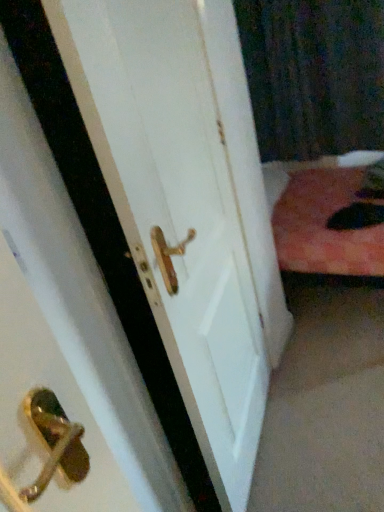
Question: Is white matte door handle at center thinner than black textured curtain at upper right?

Choices:
 (A) yes
 (B) no

Answer: (A)

Question: Is white matte door handle at center positioned far away from black textured curtain at upper right?

Choices:
 (A) yes
 (B) no

Answer: (A)

Question: Is white matte door handle at center next to black textured curtain at upper right and touching it?

Choices:
 (A) no
 (B) yes

Answer: (A)

Question: Is the depth of white matte door handle at center greater than that of black textured curtain at upper right?

Choices:
 (A) yes
 (B) no

Answer: (B)

Question: Could you tell me if white matte door handle at center is facing black textured curtain at upper right?

Choices:
 (A) yes
 (B) no

Answer: (B)

Question: From the image's perspective, is white matte door handle at center above black textured curtain at upper right?

Choices:
 (A) yes
 (B) no

Answer: (B)

Question: From the image's perspective, is fluffy black cat at lower right beneath white matte door handle at center?

Choices:
 (A) no
 (B) yes

Answer: (A)

Question: From a real-world perspective, is fluffy black cat at lower right on top of white matte door handle at center?

Choices:
 (A) yes
 (B) no

Answer: (B)

Question: Is fluffy black cat at lower right bigger than white matte door handle at center?

Choices:
 (A) no
 (B) yes

Answer: (A)

Question: Does fluffy black cat at lower right have a greater height compared to white matte door handle at center?

Choices:
 (A) yes
 (B) no

Answer: (B)

Question: Is fluffy black cat at lower right thinner than white matte door handle at center?

Choices:
 (A) no
 (B) yes

Answer: (A)

Question: Is fluffy black cat at lower right closer to the viewer compared to white matte door handle at center?

Choices:
 (A) no
 (B) yes

Answer: (A)

Question: From a real-world perspective, is black textured curtain at upper right physically below fluffy black cat at lower right?

Choices:
 (A) yes
 (B) no

Answer: (B)